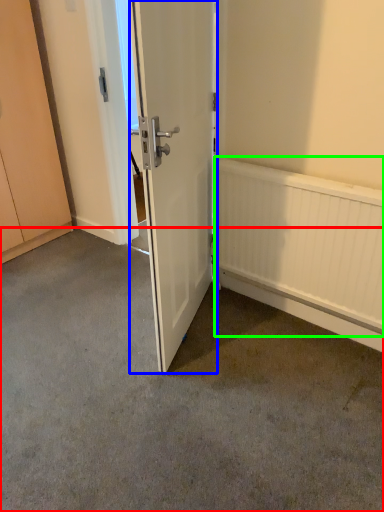
Question: Based on their relative distances, which object is nearer to concrete (highlighted by a red box)? Choose from door (highlighted by a blue box) and radiator (highlighted by a green box).

Choices:
 (A) door
 (B) radiator

Answer: (B)